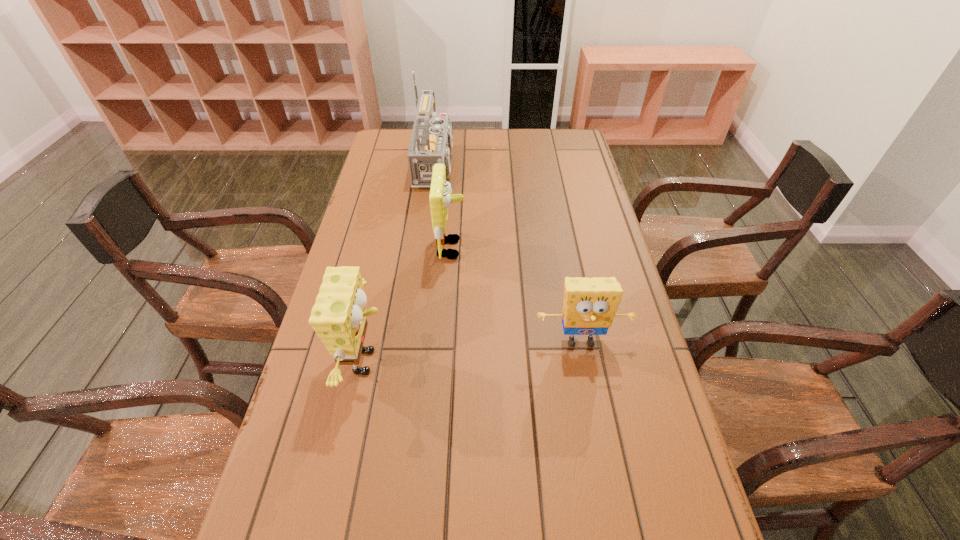
Find the location of a particular element. The height and width of the screenshot is (540, 960). free space at the far right corner of the desktop is located at coordinates pyautogui.click(x=543, y=132).

This screenshot has width=960, height=540. I want to click on free space between the tallest object and the rightmost sponge, so click(511, 253).

At what (x,y) coordinates should I click in order to perform the action: click on free point between the second sponge from left to right and the leftmost sponge. Please return your answer as a coordinate pair (x, y). This screenshot has width=960, height=540. Looking at the image, I should click on tap(409, 305).

Where is `vacant point located between the leftmost sponge and the farthest object`? The width and height of the screenshot is (960, 540). vacant point located between the leftmost sponge and the farthest object is located at coordinates (404, 264).

Find the location of `vacant point located between the second sponge from right to left and the leftmost sponge`. vacant point located between the second sponge from right to left and the leftmost sponge is located at coordinates (409, 305).

Identify the location of vacant region between the radio receiver and the rightmost sponge. The image size is (960, 540). (511, 253).

This screenshot has height=540, width=960. Find the location of `vacant point located between the shortest sponge and the farthest object`. vacant point located between the shortest sponge and the farthest object is located at coordinates (511, 253).

Locate an element on the screen. This screenshot has width=960, height=540. vacant area between the leftmost sponge and the shortest object is located at coordinates (474, 352).

I want to click on the third closest object to the farthest object, so click(589, 306).

Choose which object is the second nearest neighbor to the leftmost sponge. Please provide its 2D coordinates. Your answer should be formatted as a tuple, i.e. [(x, y)], where the tuple contains the x and y coordinates of a point satisfying the conditions above.

[(589, 306)]